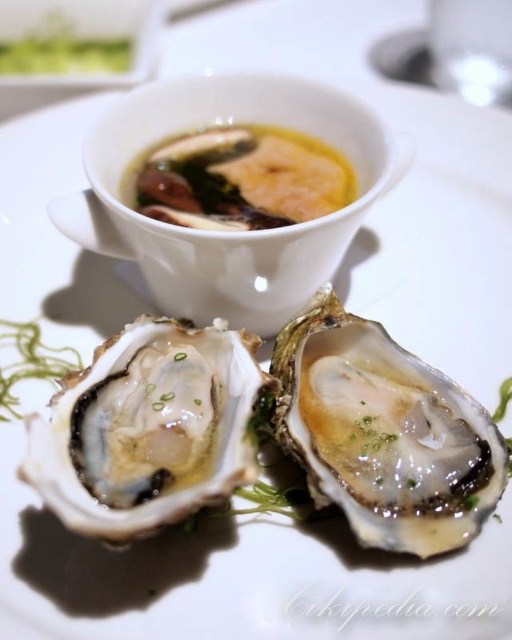
You are a food critic evaluating this dish. You need to describe the position of the shiny white oyster at center relative to the yellow creamy broth at upper center without mentioning their specific spatial relationship from the description. Use the scene context to frame your question.

The shiny white oyster at center is positioned below the yellow creamy broth at upper center, as it is placed lower on the plate compared to the broth bowl.

You are a food critic sitting at a table with this dish. You want to taste the oyster that is closer to you. Which one should you choose between the glistening white oyster at center and the shiny white oyster at center?

The glistening white oyster at center is closer to you, so you should choose that one.

You are a food critic evaluating this dish. You need to determine if the shiny white oyster at center can be fully submerged in the yellow creamy broth at upper center. Based on their thickness, can it be done?

The shiny white oyster at center is thinner than the yellow creamy broth at upper center. Since the oyster is thinner, it can be fully submerged in the broth as long as the broth depth is sufficient to cover its thickness.